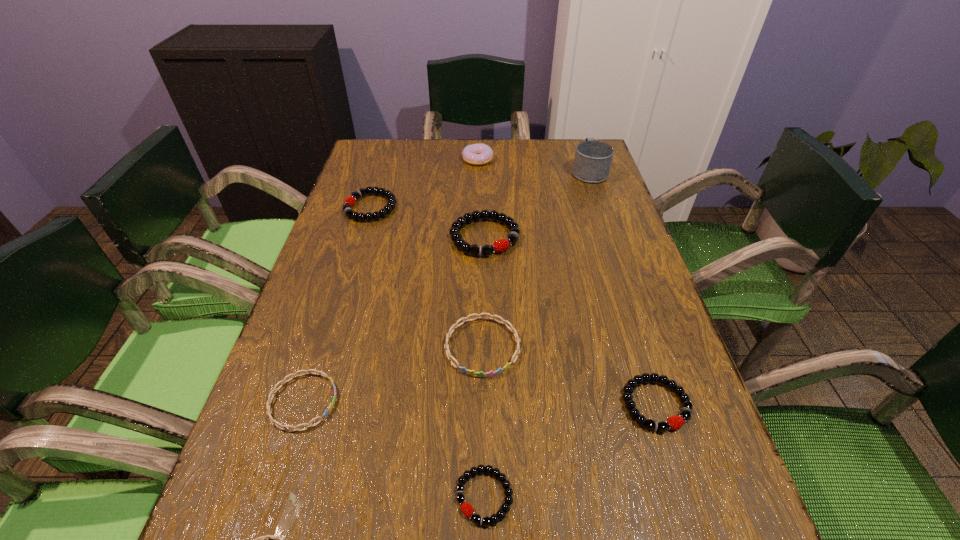
Image resolution: width=960 pixels, height=540 pixels. What are the coordinates of `doughnut at the far edge` in the screenshot? It's located at (475, 154).

The image size is (960, 540). Identify the location of mug that is at the right edge. (593, 159).

Locate an element on the screen. bracelet located at the right edge is located at coordinates (674, 422).

Locate an element on the screen. object at the far right corner is located at coordinates (593, 159).

Identify the location of vacant point at the far edge. The width and height of the screenshot is (960, 540). (461, 145).

This screenshot has height=540, width=960. I want to click on free space at the left edge, so click(333, 220).

This screenshot has height=540, width=960. Find the location of `vacant space at the right edge of the desktop`. vacant space at the right edge of the desktop is located at coordinates (611, 227).

At what (x,y) coordinates should I click in order to perform the action: click on blank space at the far left corner of the desktop. Please return your answer as a coordinate pair (x, y). Looking at the image, I should click on (376, 146).

The image size is (960, 540). In the image, there is a desktop. Identify the location of free space at the far right corner. (559, 166).

Identify the location of empty location between the rightmost black bracelet and the rightmost blue bracelet. Image resolution: width=960 pixels, height=540 pixels. (569, 375).